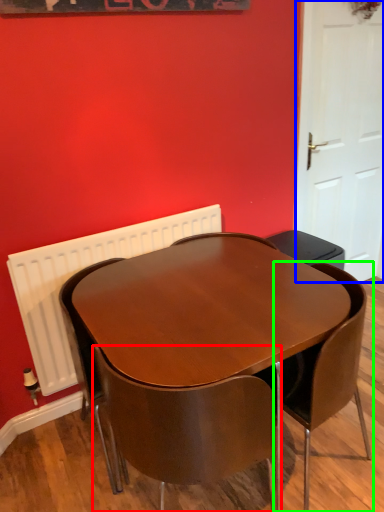
Question: Based on their relative distances, which object is nearer to chair (highlighted by a red box)? Choose from door (highlighted by a blue box) and chair (highlighted by a green box).

Choices:
 (A) door
 (B) chair

Answer: (B)